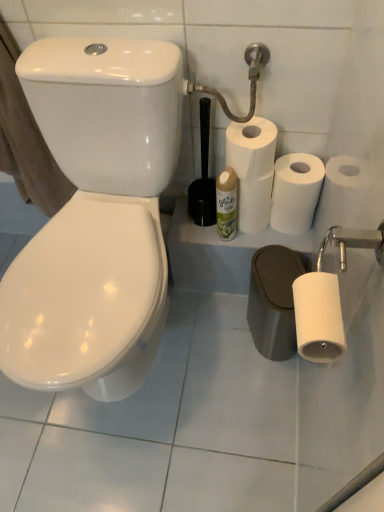
What do you see at coordinates (26, 139) in the screenshot?
I see `brown cotton bath towel at left` at bounding box center [26, 139].

In order to face white matte paper towel at center, should I rotate leftwards or rightwards?

Rotate your view right by about 7.764°.

The width and height of the screenshot is (384, 512). What do you see at coordinates (226, 204) in the screenshot?
I see `green matte spray can at center` at bounding box center [226, 204].

Measure the distance between point (307, 184) and camera.

A distance of 1.05 meters exists between point (307, 184) and camera.

Describe the element at coordinates (318, 317) in the screenshot. I see `white matte toilet paper at lower right, arranged as the third toilet paper when viewed from the top` at that location.

The width and height of the screenshot is (384, 512). I want to click on brown cotton bath towel at left, so click(26, 139).

Does metallic silver shower head at upper right have a larger size compared to white matte toilet paper at upper right, arranged as the third toilet paper when viewed from the front?

Yes.

Considering the positions of objects metallic silver shower head at upper right and white matte toilet paper at upper right, arranged as the third toilet paper when viewed from the front, in the image provided, who is more to the right, metallic silver shower head at upper right or white matte toilet paper at upper right, arranged as the third toilet paper when viewed from the front,?

white matte toilet paper at upper right, arranged as the third toilet paper when viewed from the front.

Between metallic silver shower head at upper right and white matte toilet paper at upper right, arranged as the third toilet paper when viewed from the front, which one is positioned in front?

metallic silver shower head at upper right is more forward.

Is metallic silver shower head at upper right next to white matte toilet paper at upper right, which is counted as the 2th toilet paper, starting from the bottom?

No, metallic silver shower head at upper right is not touching white matte toilet paper at upper right, which is counted as the 2th toilet paper, starting from the bottom.

Measure the distance between white matte toilet paper at lower right, arranged as the third toilet paper when viewed from the top, and brown cotton bath towel at left.

white matte toilet paper at lower right, arranged as the third toilet paper when viewed from the top, is 35.20 inches away from brown cotton bath towel at left.

Could you tell me if white matte toilet paper at lower right, arranged as the 1th toilet paper when ordered from the bottom, is turned towards brown cotton bath towel at left?

No.

Does white matte toilet paper at lower right, the 3th toilet paper viewed from the back, touch brown cotton bath towel at left?

No, white matte toilet paper at lower right, the 3th toilet paper viewed from the back, is not in contact with brown cotton bath towel at left.

Is white matte toilet paper at lower right, arranged as the 1th toilet paper when ordered from the bottom, taller than brown cotton bath towel at left?

In fact, white matte toilet paper at lower right, arranged as the 1th toilet paper when ordered from the bottom, may be shorter than brown cotton bath towel at left.

From a real-world perspective, does white matte toilet paper at lower right, arranged as the third toilet paper when viewed from the top, stand above white matte paper towel at center?

Yes, from a real-world perspective, white matte toilet paper at lower right, arranged as the third toilet paper when viewed from the top, is above white matte paper towel at center.

Is white matte toilet paper at lower right, arranged as the 1th toilet paper when ordered from the bottom, positioned before white matte paper towel at center?

That is True.

Considering the relative sizes of white matte toilet paper at lower right, arranged as the 1th toilet paper when ordered from the bottom, and white matte paper towel at center in the image provided, is white matte toilet paper at lower right, arranged as the 1th toilet paper when ordered from the bottom, wider than white matte paper towel at center?

Incorrect, the width of white matte toilet paper at lower right, arranged as the 1th toilet paper when ordered from the bottom, does not surpass that of white matte paper towel at center.

Which object is positioned more to the right, white matte toilet paper at lower right, arranged as the third toilet paper when viewed from the top, or white matte paper towel at center?

Positioned to the right is white matte paper towel at center.

Find the location of a particular element. The image size is (384, 512). toilet paper that is the 3rd one when counting downward from the metallic silver shower head at upper right (from the image's perspective) is located at coordinates (318, 317).

Looking at this image, from a real-world perspective, which is physically above, metallic silver shower head at upper right or white matte toilet paper at lower right, which appears as the 1th toilet paper when viewed from the front?

white matte toilet paper at lower right, which appears as the 1th toilet paper when viewed from the front, from a real-world perspective.

From the image's perspective, is metallic silver shower head at upper right above white matte toilet paper at lower right, the 3th toilet paper viewed from the back?

Yes, from the image's perspective, metallic silver shower head at upper right is over white matte toilet paper at lower right, the 3th toilet paper viewed from the back.

Between metallic silver shower head at upper right and white matte toilet paper at lower right, the 3th toilet paper viewed from the back, which one has larger width?

With larger width is metallic silver shower head at upper right.

Is white matte toilet paper at upper right, arranged as the third toilet paper when viewed from the front, facing towards green matte spray can at center?

No, white matte toilet paper at upper right, arranged as the third toilet paper when viewed from the front, does not turn towards green matte spray can at center.

Which toilet paper is the 3rd one when counting from the right side of the green matte spray can at center? Please provide its 2D coordinates.

[(296, 192)]

Between white matte toilet paper at upper right, placed as the 1th toilet paper when sorted from back to front, and green matte spray can at center, which one has less height?

Standing shorter between the two is white matte toilet paper at upper right, placed as the 1th toilet paper when sorted from back to front.

Which is in front, green matte spray can at center or white matte paper towel at center?

green matte spray can at center is closer to the camera.

From a real-world perspective, is green matte spray can at center positioned under white matte paper towel at center based on gravity?

No, from a real-world perspective, green matte spray can at center is not under white matte paper towel at center.

Considering the relative sizes of green matte spray can at center and white matte paper towel at center in the image provided, is green matte spray can at center bigger than white matte paper towel at center?

No, green matte spray can at center is not bigger than white matte paper towel at center.

Is white matte toilet paper at center right, the 2th toilet paper from the front, with metallic silver shower head at upper right?

There is a gap between white matte toilet paper at center right, the 2th toilet paper from the front, and metallic silver shower head at upper right.

From the image's perspective, is white matte toilet paper at center right, the 2th toilet paper from the front, above metallic silver shower head at upper right?

No, from the image's perspective, white matte toilet paper at center right, the 2th toilet paper from the front, is not over metallic silver shower head at upper right.

Considering the sizes of objects white matte toilet paper at center right, acting as the 3th toilet paper starting from the bottom, and metallic silver shower head at upper right in the image provided, who is wider, white matte toilet paper at center right, acting as the 3th toilet paper starting from the bottom, or metallic silver shower head at upper right?

Wider between the two is white matte toilet paper at center right, acting as the 3th toilet paper starting from the bottom.

Can you confirm if white matte toilet paper at center right, placed as the 1th toilet paper when sorted from top to bottom, is shorter than metallic silver shower head at upper right?

Yes, white matte toilet paper at center right, placed as the 1th toilet paper when sorted from top to bottom, is shorter than metallic silver shower head at upper right.

Locate an element on the screen. Image resolution: width=384 pixels, height=512 pixels. shower lying in front of the white matte toilet paper at upper right, placed as the 1th toilet paper when sorted from back to front is located at coordinates (248, 78).

I want to click on bath towel lying on the left of white matte toilet paper at lower right, arranged as the 1th toilet paper when ordered from the bottom, so click(x=26, y=139).

When comparing their distances from white matte toilet paper at upper right, placed as the 1th toilet paper when sorted from back to front, does white matte toilet paper at lower right, the 3th toilet paper viewed from the back, or green matte spray can at center seem closer?

Among the two, green matte spray can at center is located nearer to white matte toilet paper at upper right, placed as the 1th toilet paper when sorted from back to front.

From the image, which object appears to be farther from metallic silver shower head at upper right, white matte paper towel at center or white matte toilet paper at upper right, which is counted as the 2th toilet paper, starting from the bottom?

white matte toilet paper at upper right, which is counted as the 2th toilet paper, starting from the bottom, is further to metallic silver shower head at upper right.

Considering their positions, is white matte paper towel at center positioned further to brown cotton bath towel at left than metallic silver shower head at upper right?

The object further to brown cotton bath towel at left is white matte paper towel at center.

When comparing their distances from brown cotton bath towel at left, does green matte spray can at center or metallic silver shower head at upper right seem further?

Based on the image, green matte spray can at center appears to be further to brown cotton bath towel at left.

From the image, which object appears to be nearer to white matte toilet paper at lower right, arranged as the third toilet paper when viewed from the top, white matte toilet paper at center right, placed as the 1th toilet paper when sorted from top to bottom, or green matte spray can at center?

The object closer to white matte toilet paper at lower right, arranged as the third toilet paper when viewed from the top, is white matte toilet paper at center right, placed as the 1th toilet paper when sorted from top to bottom.

Looking at the image, which one is located further to white matte paper towel at center, white matte toilet paper at upper right, the second toilet paper when ordered from top to bottom, or white matte toilet paper at lower right, arranged as the third toilet paper when viewed from the top?

Among the two, white matte toilet paper at lower right, arranged as the third toilet paper when viewed from the top, is located further to white matte paper towel at center.

Considering their positions, is white matte paper towel at center positioned closer to white matte toilet paper at upper right, placed as the 1th toilet paper when sorted from back to front, than metallic silver shower head at upper right?

The object closer to white matte toilet paper at upper right, placed as the 1th toilet paper when sorted from back to front, is white matte paper towel at center.

From the picture: Looking at the image, which one is located further to brown cotton bath towel at left, white matte toilet paper at center right, placed as the 1th toilet paper when sorted from top to bottom, or white matte toilet paper at upper right, placed as the 1th toilet paper when sorted from back to front?

white matte toilet paper at upper right, placed as the 1th toilet paper when sorted from back to front, is further to brown cotton bath towel at left.

I want to click on cleaning product positioned between metallic silver shower head at upper right and white matte paper towel at center from near to far, so click(x=226, y=204).

Find the location of a particular element. cleaning product located between white matte toilet paper at center right, placed as the 1th toilet paper when sorted from top to bottom, and white matte paper towel at center in the depth direction is located at coordinates (226, 204).

You are a GUI agent. You are given a task and a screenshot of the screen. Output one action in this format:
    pyautogui.click(x=<x>, y=<y>)
    Task: Click on the cleaning product between brown cotton bath towel at left and white matte toilet paper at lower right, arranged as the third toilet paper when viewed from the top, from left to right
    Image resolution: width=384 pixels, height=512 pixels.
    Given the screenshot: What is the action you would take?
    pyautogui.click(x=226, y=204)

In order to click on toilet paper positioned between white matte toilet paper at center right, the 2th toilet paper from the front, and white matte paper towel at center from near to far in this screenshot , I will do `click(296, 192)`.